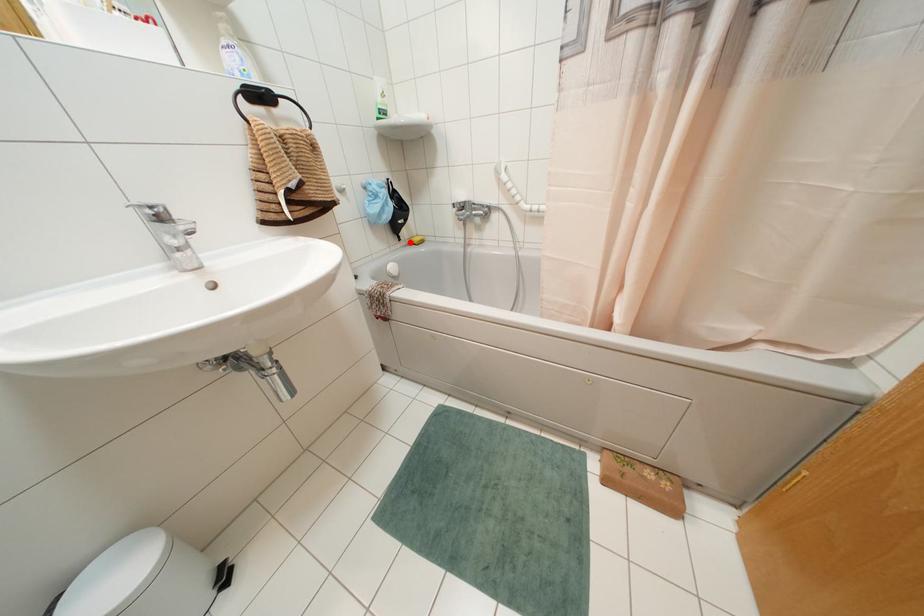
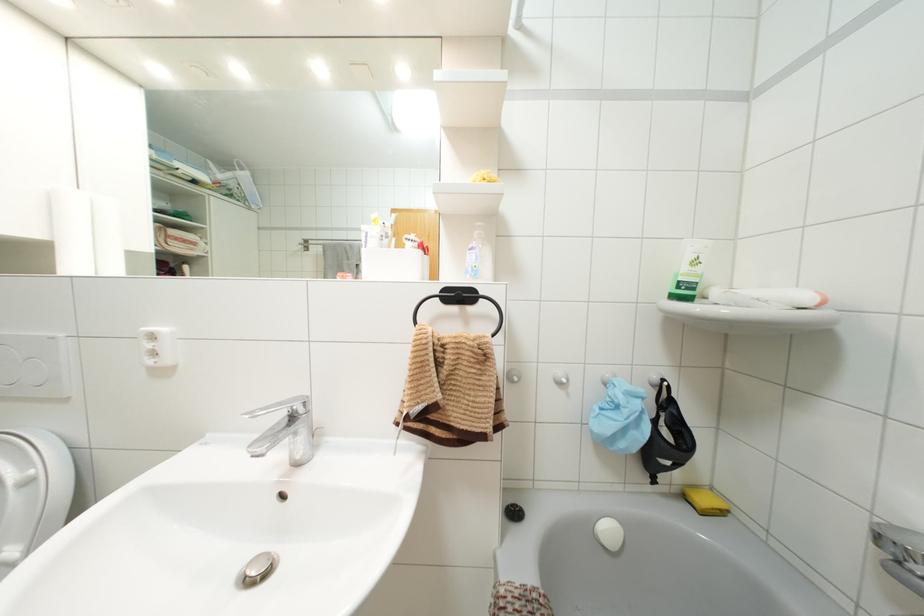
In the second image, find the point that corresponds to the highlighted location in the first image.

(685, 496)